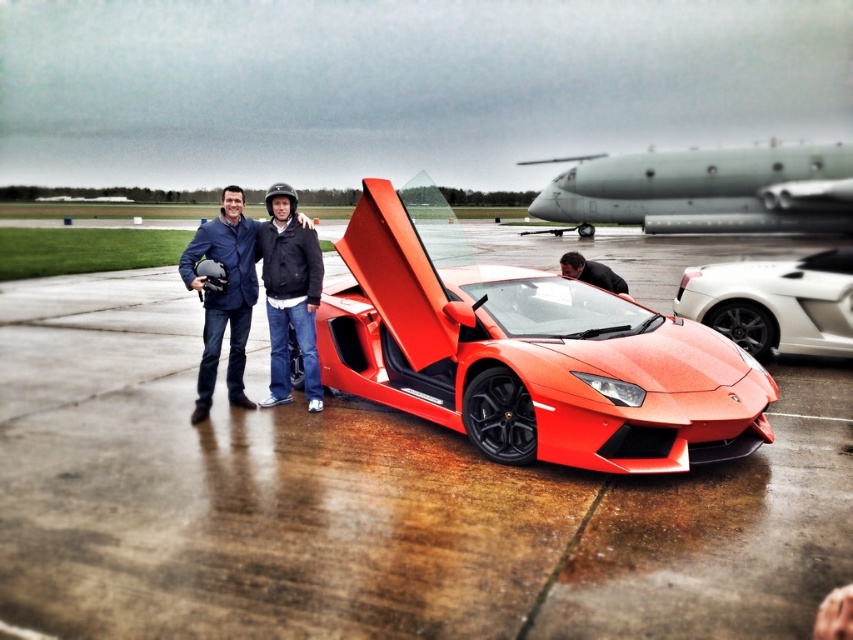
Question: Is glossy orange sports car at center above matte black jacket at center?

Choices:
 (A) no
 (B) yes

Answer: (B)

Question: Which point is closer to the camera?

Choices:
 (A) matte black jacket at center
 (B) white glossy sports car at right
 (C) matte blue jacket at center

Answer: (C)

Question: Among these objects, which one is nearest to the camera?

Choices:
 (A) matte black helmet at lower center
 (B) matte blue jacket at center
 (C) metallic gray airplane at upper center
 (D) glossy orange sports car at center

Answer: (D)

Question: Is white glossy sports car at right bigger than matte blue jacket at center?

Choices:
 (A) no
 (B) yes

Answer: (B)

Question: In this image, where is matte blue jacket at center located relative to matte black jacket at center?

Choices:
 (A) above
 (B) below

Answer: (B)

Question: Which point is closer to the camera?

Choices:
 (A) (595, 273)
 (B) (849, 192)
 (C) (605, 589)
 (D) (248, 294)

Answer: (C)